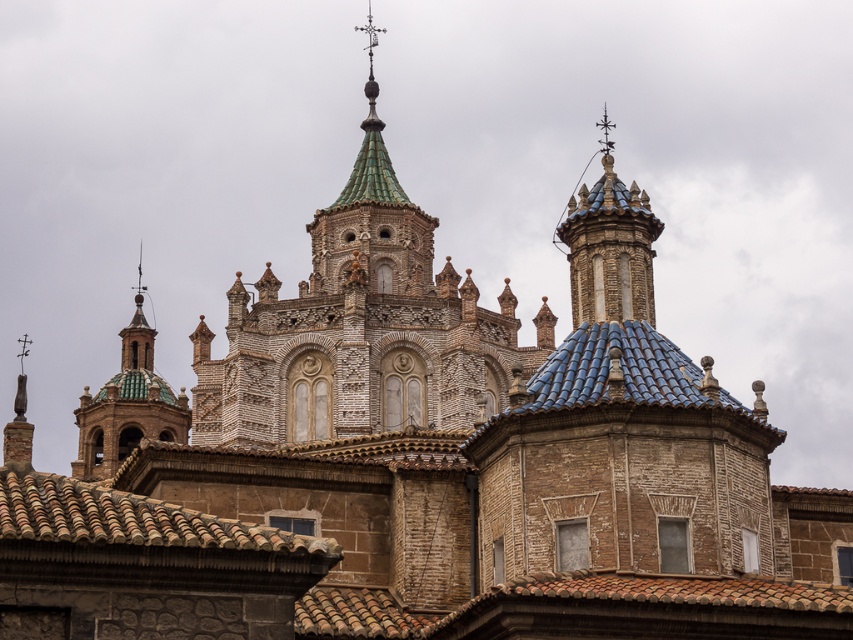
Is point (494, 337) in front of point (103, 401)?

Yes, it is in front of point (103, 401).

Is green glazed tile tower at center thinner than green glazed tile dome at upper left?

No.

Is point (257, 358) positioned before point (76, 476)?

That is True.

This screenshot has height=640, width=853. In order to click on green glazed tile tower at center in this screenshot , I will do `click(361, 326)`.

Between blue glazed tiles at upper center and green glazed tile dome at upper left, which one has more height?

blue glazed tiles at upper center is taller.

Does blue glazed tiles at upper center have a lesser width compared to green glazed tile dome at upper left?

Yes.

At what (x,y) coordinates should I click in order to perform the action: click on blue glazed tiles at upper center. Please return your answer as a coordinate pair (x, y). Looking at the image, I should click on (608, 246).

Which is more to the right, green glazed tile tower at center or blue glazed tiles at upper center?

Positioned to the right is blue glazed tiles at upper center.

Is green glazed tile tower at center taller than blue glazed tiles at upper center?

Correct, green glazed tile tower at center is much taller as blue glazed tiles at upper center.

Describe the element at coordinates (361, 326) in the screenshot. Image resolution: width=853 pixels, height=640 pixels. I see `green glazed tile tower at center` at that location.

The width and height of the screenshot is (853, 640). I want to click on green glazed tile tower at center, so click(361, 326).